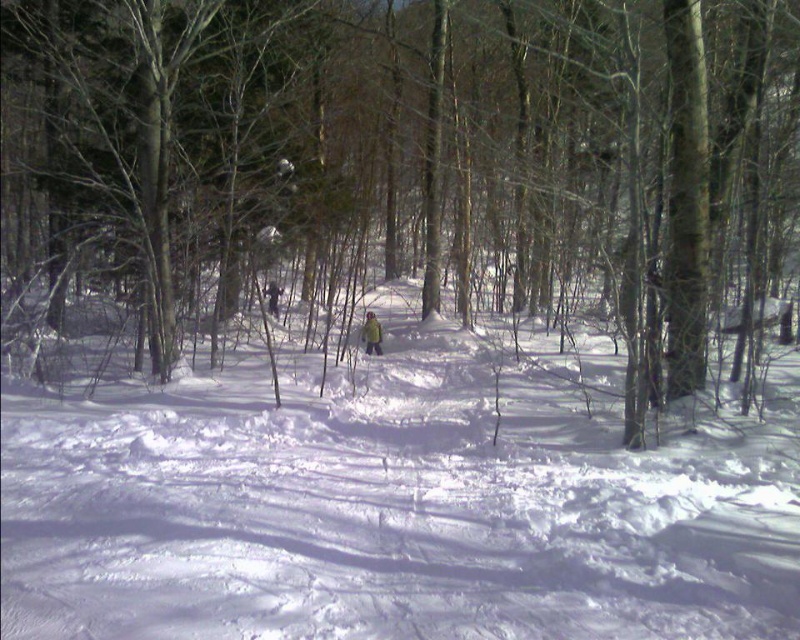
You are an observer in the winter forest scene. You notice the brown smooth tree at center and the green fabric person at center. Which object is wider in terms of their width?

The brown smooth tree at center is wider than the green fabric person at center.

You are a hiker who wants to take a photo of the brown smooth tree at center and the white fluffy snow at center. Since you want both objects in focus, you need to adjust your camera settings. Which object should you focus on to ensure both are sharp?

You should focus on the brown smooth tree at center because it is closer to you than the white fluffy snow at center. By focusing on the closer object, the depth of field will extend further, potentially keeping both in focus.

You are a hiker trying to navigate through the snowy forest. You see a brown smooth tree at center and a green fabric person at center. Which object is positioned to the left of the other?

The brown smooth tree at center is to the left of the green fabric person at center.